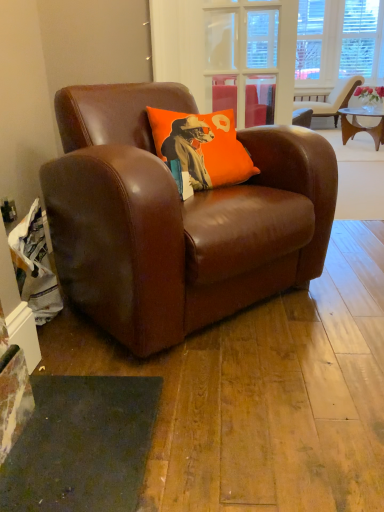
Question: Considering the relative sizes of orange fabric pillow at center and brown leather chair at center, which is counted as the first chair, starting from the left, in the image provided, is orange fabric pillow at center bigger than brown leather chair at center, which is counted as the first chair, starting from the left,?

Choices:
 (A) yes
 (B) no

Answer: (B)

Question: From the image's perspective, is orange fabric pillow at center under brown leather chair at center, which appears as the second chair when viewed from the right?

Choices:
 (A) no
 (B) yes

Answer: (A)

Question: Are orange fabric pillow at center and brown leather chair at center, positioned as the second chair in back-to-front order, far apart?

Choices:
 (A) no
 (B) yes

Answer: (A)

Question: Could you tell me if orange fabric pillow at center is turned towards brown leather chair at center, which appears as the second chair when viewed from the right?

Choices:
 (A) no
 (B) yes

Answer: (B)

Question: Does orange fabric pillow at center appear on the left side of brown leather chair at center, positioned as the 1th chair in front-to-back order?

Choices:
 (A) no
 (B) yes

Answer: (A)

Question: Looking at their shapes, would you say orange fabric pillow at center is wider or thinner than brown leather chair at center, which is counted as the 1th chair, starting from the bottom?

Choices:
 (A) thin
 (B) wide

Answer: (A)

Question: Is orange fabric pillow at center in front of or behind brown leather chair at center, which is counted as the first chair, starting from the left, in the image?

Choices:
 (A) behind
 (B) front

Answer: (A)

Question: Does point (210, 186) appear closer or farther from the camera than point (213, 205)?

Choices:
 (A) farther
 (B) closer

Answer: (A)

Question: Is orange fabric pillow at center inside the boundaries of brown leather chair at center, positioned as the second chair in back-to-front order, or outside?

Choices:
 (A) outside
 (B) inside

Answer: (B)

Question: In terms of width, does beige leather chair at upper right, which is the 1th chair in top-to-bottom order, look wider or thinner when compared to orange fabric pillow at center?

Choices:
 (A) wide
 (B) thin

Answer: (A)

Question: Is point (294, 108) closer or farther from the camera than point (223, 159)?

Choices:
 (A) farther
 (B) closer

Answer: (A)

Question: In the image, is beige leather chair at upper right, the second chair from the front, positioned in front of or behind orange fabric pillow at center?

Choices:
 (A) behind
 (B) front

Answer: (A)

Question: Is beige leather chair at upper right, which is the 2th chair in bottom-to-top order, inside or outside of orange fabric pillow at center?

Choices:
 (A) inside
 (B) outside

Answer: (B)

Question: Is point (261, 110) closer or farther from the camera than point (142, 257)?

Choices:
 (A) farther
 (B) closer

Answer: (A)

Question: In terms of height, does transparent glass door at upper center look taller or shorter compared to brown leather chair at center, which appears as the second chair when viewed from the right?

Choices:
 (A) short
 (B) tall

Answer: (A)